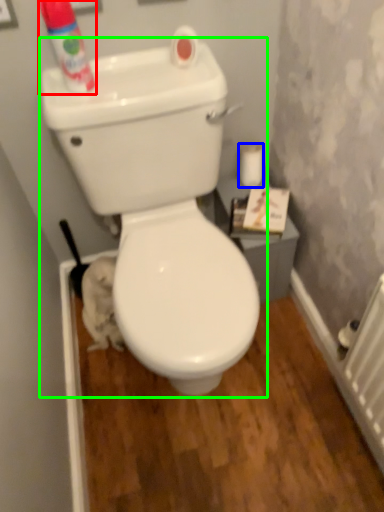
Question: Which object is positioned closest to cleaning product (highlighted by a red box)? Select from toilet paper (highlighted by a blue box) and toilet (highlighted by a green box).

Choices:
 (A) toilet paper
 (B) toilet

Answer: (B)